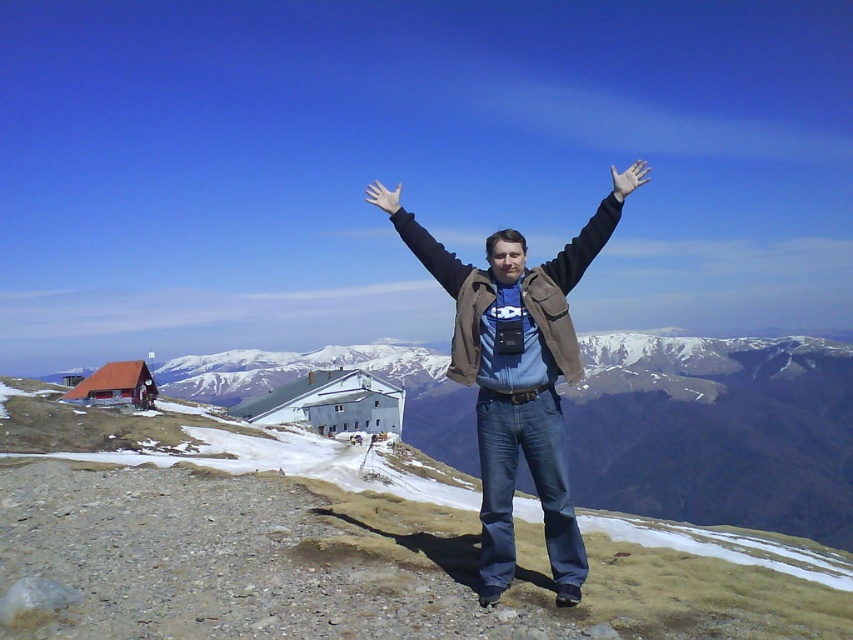
Question: Which point is closer to the camera taking this photo?

Choices:
 (A) (428, 252)
 (B) (637, 168)
 (C) (387, 189)
 (D) (494, 470)

Answer: (D)

Question: Does black leather arm at center appear on the left side of white matte hand at upper center?

Choices:
 (A) no
 (B) yes

Answer: (B)

Question: Which of these objects is positioned farthest from the black leather arm at center?

Choices:
 (A) black matte arm at center
 (B) white matte hand at upper center

Answer: (B)

Question: Is brown leather jacket at center closer to the viewer compared to black leather arm at center?

Choices:
 (A) yes
 (B) no

Answer: (A)

Question: Which of the following is the farthest from the observer?

Choices:
 (A) (578, 244)
 (B) (397, 200)

Answer: (B)

Question: In this image, where is black matte arm at center located relative to white matte hand at upper center?

Choices:
 (A) right
 (B) left

Answer: (B)